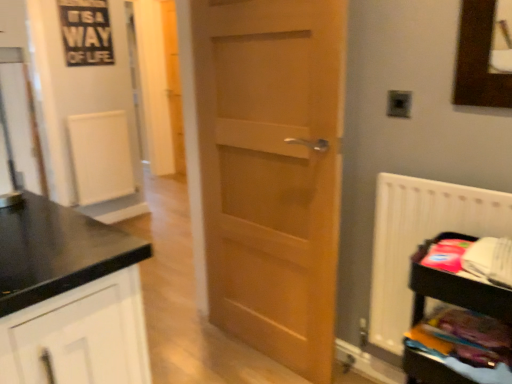
Locate an element on the screen. The width and height of the screenshot is (512, 384). wooden shelf at lower right is located at coordinates (453, 286).

Where is `light brown wood door at center`? This screenshot has height=384, width=512. light brown wood door at center is located at coordinates (272, 171).

Locate an element on the screen. The width and height of the screenshot is (512, 384). white plastic radiator at right is located at coordinates (420, 240).

You are a GUI agent. You are given a task and a screenshot of the screen. Output one action in this format:
    pyautogui.click(x=<x>, y=<y>)
    Task: Click on the electric outlet above the wooden shelf at lower right (from the image's perspective)
    The height and width of the screenshot is (384, 512).
    Given the screenshot: What is the action you would take?
    pyautogui.click(x=399, y=103)

Who is taller, metallic silver electric outlet at upper right or wooden shelf at lower right?

wooden shelf at lower right is taller.

Looking at their sizes, would you say metallic silver electric outlet at upper right is wider or thinner than wooden shelf at lower right?

Clearly, metallic silver electric outlet at upper right has less width compared to wooden shelf at lower right.

Considering the points (438, 298) and (37, 138), which point is in front, point (438, 298) or point (37, 138)?

The point (438, 298) is more forward.

Is wooden shelf at lower right oriented away from transparent glass door at left?

No.

From a real-world perspective, is wooden shelf at lower right physically above transparent glass door at left?

No, from a real-world perspective, wooden shelf at lower right is not over transparent glass door at left

Can you confirm if wooden shelf at lower right is smaller than transparent glass door at left?

Actually, wooden shelf at lower right might be larger than transparent glass door at left.

From the image's perspective, between metallic silver electric outlet at upper right and white plastic radiator at right, who is located below?

white plastic radiator at right is shown below in the image.

Which of these two, metallic silver electric outlet at upper right or white plastic radiator at right, is thinner?

metallic silver electric outlet at upper right is thinner.

Consider the image. From a real-world perspective, who is located higher, metallic silver electric outlet at upper right or white plastic radiator at right?

metallic silver electric outlet at upper right, from a real-world perspective.

Which object is positioned more to the left, metallic silver electric outlet at upper right or white plastic radiator at right?

metallic silver electric outlet at upper right.

From the image's perspective, which one is positioned lower, white plastic radiator at right or wooden shelf at lower right?

wooden shelf at lower right.

How many degrees apart are the facing directions of white plastic radiator at right and wooden shelf at lower right?

The facing directions of white plastic radiator at right and wooden shelf at lower right are 0.0909 degrees apart.

How distant is white plastic radiator at right from wooden shelf at lower right?

white plastic radiator at right and wooden shelf at lower right are 9.57 inches apart from each other.

Considering the points (374, 316) and (411, 288), which point is in front, point (374, 316) or point (411, 288)?

The point (411, 288) is in front.

Considering the relative sizes of light brown wood door at center and white plastic radiator at right in the image provided, is light brown wood door at center bigger than white plastic radiator at right?

Yes.

Is light brown wood door at center not within white plastic radiator at right?

That's correct, light brown wood door at center is outside of white plastic radiator at right.

Would you consider light brown wood door at center to be distant from white plastic radiator at right?

light brown wood door at center is near white plastic radiator at right, not far away.

Which of these two, light brown wood door at center or white plastic radiator at right, is thinner?

light brown wood door at center is thinner.

From a real-world perspective, is transparent glass door at left physically located above or below wooden shelf at lower right?

From a real-world perspective, transparent glass door at left is physically above wooden shelf at lower right.

Looking at this image, would you say transparent glass door at left is outside wooden shelf at lower right?

Absolutely, transparent glass door at left is external to wooden shelf at lower right.

Considering the sizes of transparent glass door at left and wooden shelf at lower right in the image, is transparent glass door at left wider or thinner than wooden shelf at lower right?

transparent glass door at left is thinner than wooden shelf at lower right.

Which object is positioned more to the right, transparent glass door at left or wooden shelf at lower right?

From the viewer's perspective, wooden shelf at lower right appears more on the right side.

Is white plastic radiator at right turned away from transparent glass door at left?

white plastic radiator at right is not turned away from transparent glass door at left.

Considering the sizes of objects white plastic radiator at right and transparent glass door at left in the image provided, who is smaller, white plastic radiator at right or transparent glass door at left?

With smaller size is transparent glass door at left.

From a real-world perspective, which is physically above, white plastic radiator at right or transparent glass door at left?

In real-world perspective, transparent glass door at left is above.

Considering the positions of objects white plastic radiator at right and transparent glass door at left in the image provided, who is behind, white plastic radiator at right or transparent glass door at left?

white plastic radiator at right is further away from the camera.

This screenshot has width=512, height=384. Identify the location of electric outlet to the left of wooden shelf at lower right. (399, 103).

Locate an element on the screen. This screenshot has height=384, width=512. shelf below the transparent glass door at left (from the image's perspective) is located at coordinates (453, 286).

Based on their spatial positions, is metallic silver electric outlet at upper right or wooden shelf at lower right further from transparent glass door at left?

metallic silver electric outlet at upper right lies further to transparent glass door at left than the other object.

Estimate the real-world distances between objects in this image. Which object is closer to transparent glass door at left, wooden shelf at lower right or metallic silver electric outlet at upper right?

wooden shelf at lower right lies closer to transparent glass door at left than the other object.

From the image, which object appears to be nearer to light brown wood door at center, metallic silver electric outlet at upper right or transparent glass door at left?

metallic silver electric outlet at upper right is positioned closer to the anchor light brown wood door at center.

Estimate the real-world distances between objects in this image. Which object is closer to white plastic radiator at right, light brown wood door at center or wooden shelf at lower right?

The object closer to white plastic radiator at right is wooden shelf at lower right.

From the image, which object appears to be farther from transparent glass door at left, metallic silver electric outlet at upper right or light brown wood door at center?

Among the two, metallic silver electric outlet at upper right is located further to transparent glass door at left.

When comparing their distances from metallic silver electric outlet at upper right, does light brown wood door at center or wooden shelf at lower right seem further?

light brown wood door at center is further to metallic silver electric outlet at upper right.

From the image, which object appears to be nearer to light brown wood door at center, white plastic radiator at right or metallic silver electric outlet at upper right?

white plastic radiator at right is positioned closer to the anchor light brown wood door at center.

Looking at the image, which one is located further to white plastic radiator at right, wooden shelf at lower right or metallic silver electric outlet at upper right?

metallic silver electric outlet at upper right is further to white plastic radiator at right.

You are a GUI agent. You are given a task and a screenshot of the screen. Output one action in this format:
    pyautogui.click(x=<x>, y=<y>)
    Task: Click on the electric outlet between transparent glass door at left and white plastic radiator at right in the horizontal direction
    The width and height of the screenshot is (512, 384).
    Given the screenshot: What is the action you would take?
    pyautogui.click(x=399, y=103)

This screenshot has height=384, width=512. What are the coordinates of `door situated between transparent glass door at left and metallic silver electric outlet at upper right from left to right` in the screenshot? It's located at (272, 171).

I want to click on door between metallic silver electric outlet at upper right and white plastic radiator at right from top to bottom, so click(272, 171).

At what (x,y) coordinates should I click in order to perform the action: click on electric outlet located between transparent glass door at left and wooden shelf at lower right in the left-right direction. Please return your answer as a coordinate pair (x, y). This screenshot has height=384, width=512. Looking at the image, I should click on (399, 103).